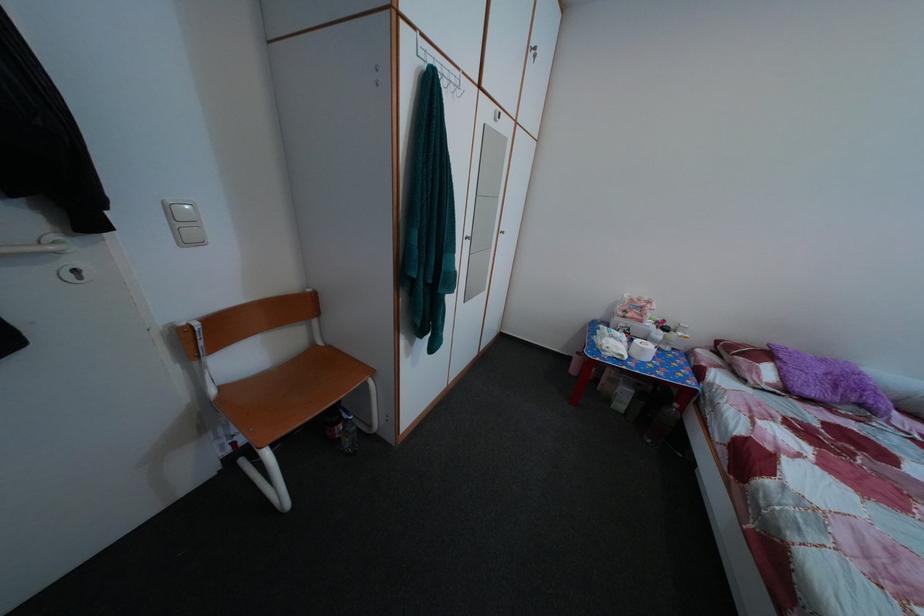
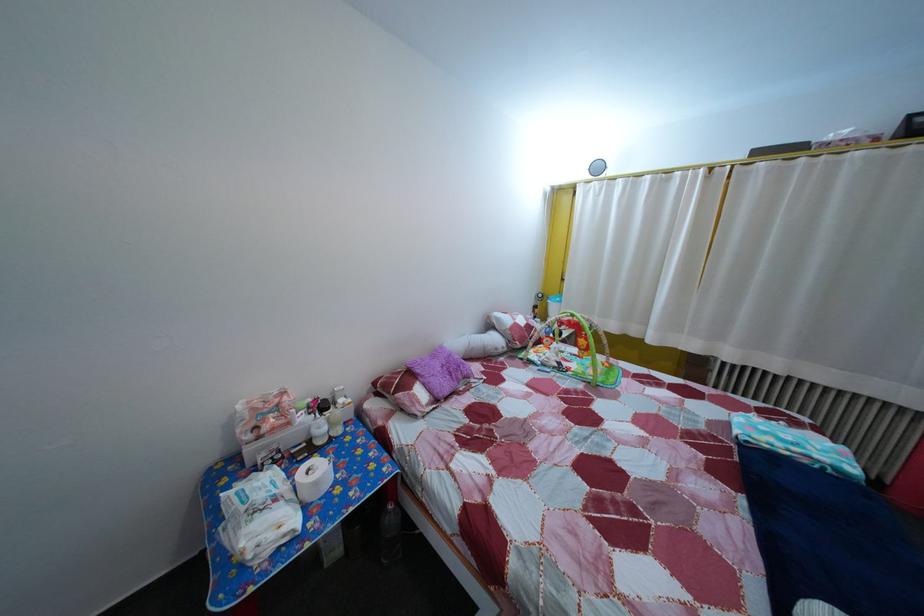
The point at (686, 413) is marked in the first image. Where is the corresponding point in the second image?

(399, 515)